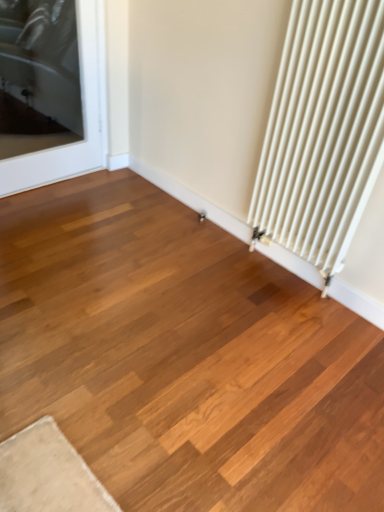
Where is `free area below transparent glass door at upper left (from a real-world perspective)`? The width and height of the screenshot is (384, 512). free area below transparent glass door at upper left (from a real-world perspective) is located at coordinates (52, 182).